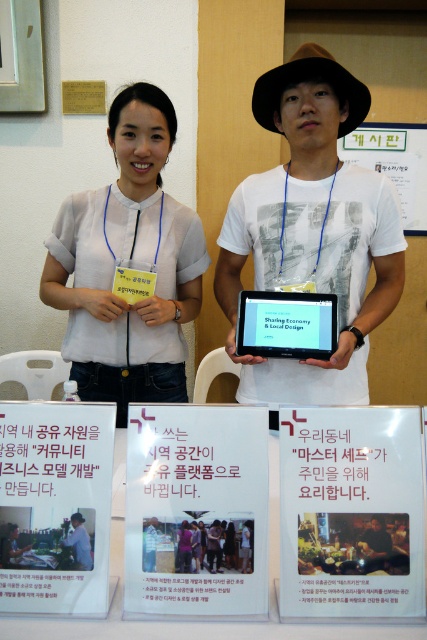
Question: Can you confirm if white cotton t-shirt at center is smaller than white paper at lower left?

Choices:
 (A) yes
 (B) no

Answer: (B)

Question: Is white paper sign at center to the right of light blue shirt at center from the viewer's perspective?

Choices:
 (A) no
 (B) yes

Answer: (B)

Question: Which point appears closest to the camera in this image?

Choices:
 (A) (75, 522)
 (B) (403, 145)
 (C) (172, 374)
 (D) (345, 500)

Answer: (A)

Question: From the image, what is the correct spatial relationship of green paper at upper center in relation to brown leather jacket at center?

Choices:
 (A) left
 (B) right

Answer: (B)

Question: Among these points, which one is nearest to the camera?

Choices:
 (A) (421, 502)
 (B) (88, 561)

Answer: (B)

Question: Which of the following is the closest to the observer?

Choices:
 (A) brown leather jacket at center
 (B) green paper at upper center

Answer: (A)